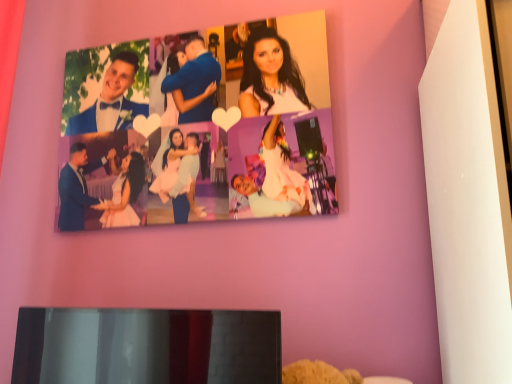
I want to click on metallic silver frame at center, so click(x=148, y=346).

The height and width of the screenshot is (384, 512). Describe the element at coordinates (148, 346) in the screenshot. I see `metallic silver frame at center` at that location.

Identify the location of metallic silver frame at center. (148, 346).